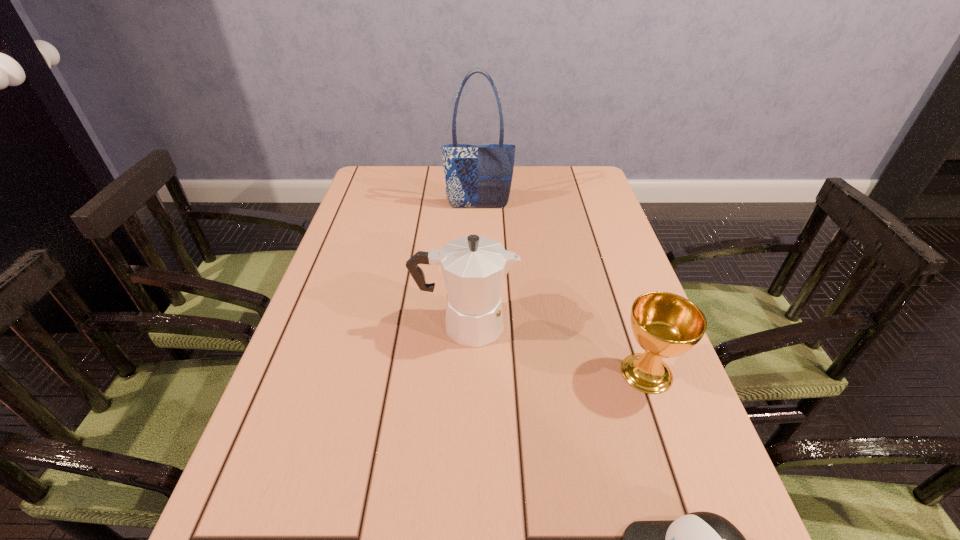
This screenshot has width=960, height=540. What are the coordinates of `free region that satisfies the following two spatial constraints: 1. on the back side of the third tallest object; 2. at the spout of the third nearest object` in the screenshot? It's located at (630, 325).

The height and width of the screenshot is (540, 960). I want to click on blank area in the image that satisfies the following two spatial constraints: 1. on the front-facing side of the chalice; 2. on the left side of the farthest object, so click(477, 373).

Find the location of `vacant space that satisfies the following two spatial constraints: 1. on the front-facing side of the tallest object; 2. at the spout of the second tallest object`. vacant space that satisfies the following two spatial constraints: 1. on the front-facing side of the tallest object; 2. at the spout of the second tallest object is located at coordinates [x=478, y=325].

Identify the location of free space in the image that satisfies the following two spatial constraints: 1. on the front-facing side of the second shortest object; 2. on the left side of the tallest object. (477, 373).

At what (x,y) coordinates should I click in order to perform the action: click on vacant position in the image that satisfies the following two spatial constraints: 1. on the front-facing side of the shopping bag; 2. at the spout of the third shortest object. Please return your answer as a coordinate pair (x, y). The height and width of the screenshot is (540, 960). Looking at the image, I should click on (478, 325).

The height and width of the screenshot is (540, 960). I want to click on vacant space that satisfies the following two spatial constraints: 1. on the front-facing side of the shopping bag; 2. on the right side of the third tallest object, so click(477, 373).

Locate an element on the screen. vacant space that satisfies the following two spatial constraints: 1. on the front-facing side of the third tallest object; 2. on the left side of the shopping bag is located at coordinates (477, 373).

I want to click on free space in the image that satisfies the following two spatial constraints: 1. on the front-facing side of the farthest object; 2. at the spout of the second farthest object, so click(478, 325).